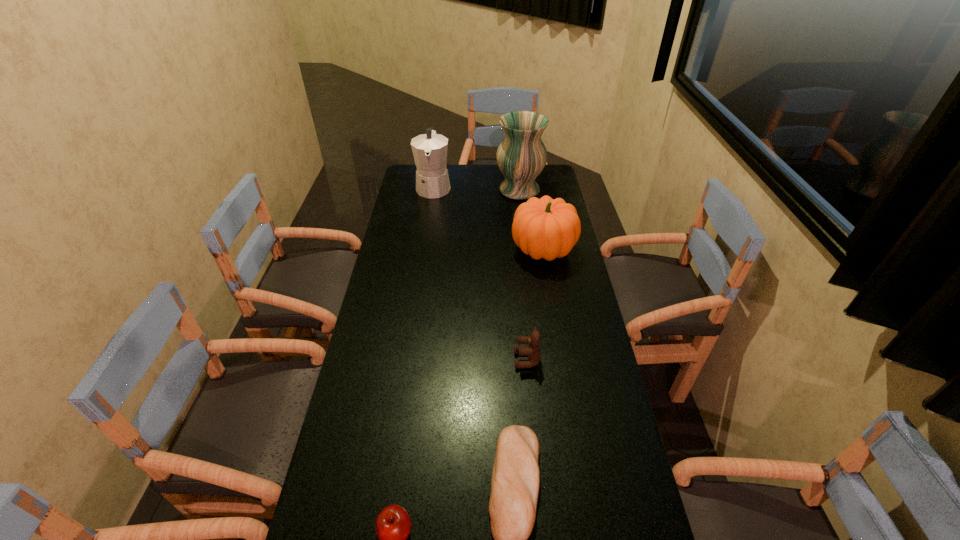
Image resolution: width=960 pixels, height=540 pixels. Find the location of `free region located 0.250m on the face of the third shortest object`. free region located 0.250m on the face of the third shortest object is located at coordinates (430, 360).

Locate an element on the screen. This screenshot has width=960, height=540. vacant space located on the face of the third shortest object is located at coordinates (414, 360).

What are the coordinates of `vase positioned at the far edge` in the screenshot? It's located at (521, 156).

Image resolution: width=960 pixels, height=540 pixels. I want to click on coffeepot present at the far edge, so click(x=429, y=150).

Locate an element on the screen. object that is at the left edge is located at coordinates click(429, 150).

The width and height of the screenshot is (960, 540). I want to click on vase located in the right edge section of the desktop, so click(x=521, y=156).

Locate an element on the screen. The image size is (960, 540). pumpkin that is at the right edge is located at coordinates (545, 228).

Find the location of `object that is at the far left corner`. object that is at the far left corner is located at coordinates (429, 150).

You are a GUI agent. You are given a task and a screenshot of the screen. Output one action in this format:
    pyautogui.click(x=<x>, y=<y>)
    Task: Click on the object at the far right corner
    
    Given the screenshot: What is the action you would take?
    pyautogui.click(x=521, y=156)

The image size is (960, 540). I want to click on vacant space at the left edge of the desktop, so click(399, 354).